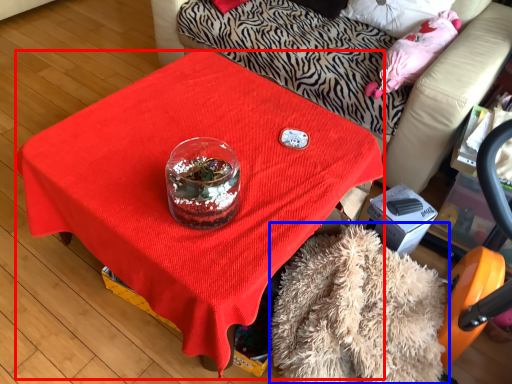
Question: Which of the following is the farthest to the observer, desk (highlighted by a red box) or blanket (highlighted by a blue box)?

Choices:
 (A) desk
 (B) blanket

Answer: (A)